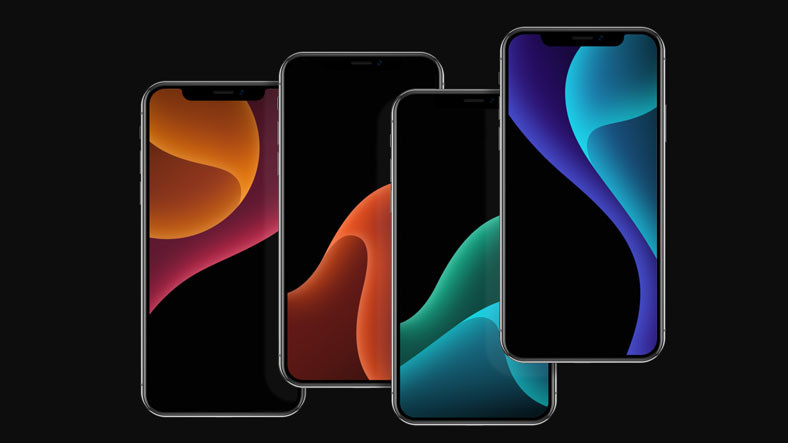
Find the location of a particular element. This screenshot has height=443, width=788. 1 phone with deep blue on screen is located at coordinates (545, 115).